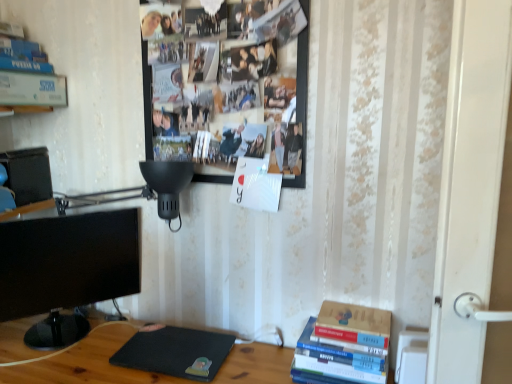
At what (x,y) coordinates should I click in order to perform the action: click on vacant area on top of black matte laptop at lower center (from a real-world perspective). Please return your answer as a coordinate pair (x, y). Image resolution: width=512 pixels, height=384 pixels. Looking at the image, I should click on (167, 346).